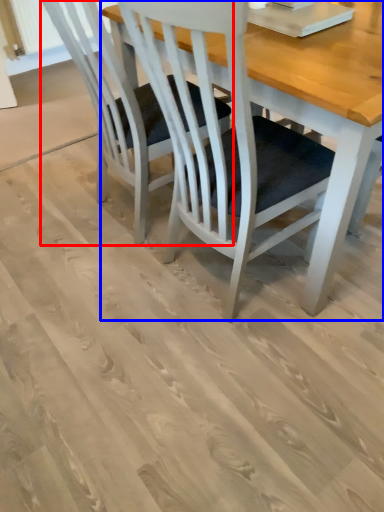
Question: Which object is further to the camera taking this photo, chair (highlighted by a red box) or table (highlighted by a blue box)?

Choices:
 (A) chair
 (B) table

Answer: (A)